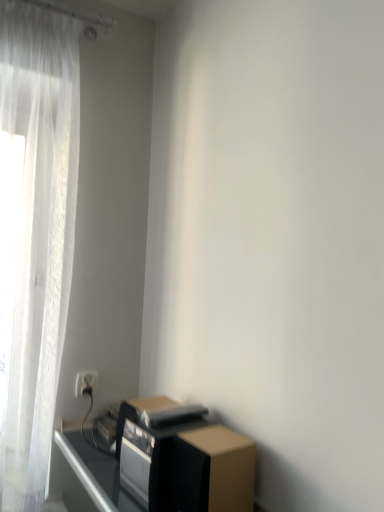
I want to click on vacant space situated above black matte speaker at lower right (from a real-world perspective), so click(x=157, y=419).